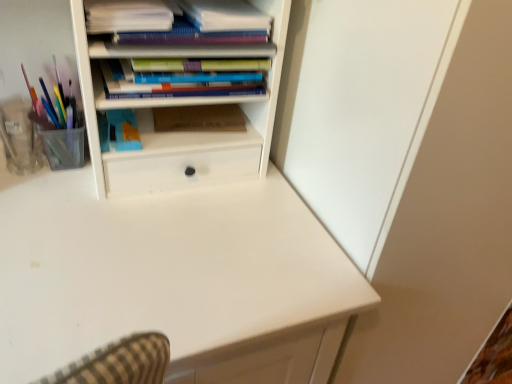
You are a GUI agent. You are given a task and a screenshot of the screen. Output one action in this format:
    pyautogui.click(x=<x>, y=<y>)
    Task: Click on the hardcover books at upper center, the first book positioned from the bottom
    
    Given the screenshot: What is the action you would take?
    pyautogui.click(x=177, y=82)

This screenshot has height=384, width=512. Identify the location of white paper stack at upper left, acting as the first book starting from the top. (127, 16).

Where is `blue matte paperback book at center, placed as the 2th paperback book when sorted from right to left`? blue matte paperback book at center, placed as the 2th paperback book when sorted from right to left is located at coordinates (123, 130).

This screenshot has width=512, height=384. Identify the location of white matte desk at center. (174, 280).

This screenshot has width=512, height=384. What do you see at coordinates (174, 280) in the screenshot? I see `white matte desk at center` at bounding box center [174, 280].

This screenshot has height=384, width=512. I want to click on hardcover books at upper center, the first book positioned from the bottom, so click(177, 82).

In terms of height, does white paper stack at upper left, the third book positioned from the bottom, look taller or shorter compared to blue matte paperback book at center, the 1th paperback book viewed from the left?

white paper stack at upper left, the third book positioned from the bottom, is taller than blue matte paperback book at center, the 1th paperback book viewed from the left.

Based on the photo, is white paper stack at upper left, acting as the first book starting from the top, wider than blue matte paperback book at center, the 1th paperback book viewed from the left?

Correct, the width of white paper stack at upper left, acting as the first book starting from the top, exceeds that of blue matte paperback book at center, the 1th paperback book viewed from the left.

Is white paper stack at upper left, acting as the first book starting from the top, smaller than blue matte paperback book at center, placed as the 2th paperback book when sorted from right to left?

No, white paper stack at upper left, acting as the first book starting from the top, is not smaller than blue matte paperback book at center, placed as the 2th paperback book when sorted from right to left.

Find the location of `paperback book on the left of white paper stack at upper left, the third book positioned from the bottom`. paperback book on the left of white paper stack at upper left, the third book positioned from the bottom is located at coordinates (123, 130).

Is white matte desk at center situated inside hardcover books at upper center, the first book positioned from the bottom, or outside?

white matte desk at center is not enclosed by hardcover books at upper center, the first book positioned from the bottom.

From a real-world perspective, who is located higher, white matte desk at center or hardcover books at upper center, the third book from the top?

From a 3D spatial view, hardcover books at upper center, the third book from the top, is above.

Considering the positions of objects white matte desk at center and hardcover books at upper center, the third book from the top, in the image provided, who is more to the left, white matte desk at center or hardcover books at upper center, the third book from the top,?

white matte desk at center.

Which of these two, white matte desk at center or hardcover books at upper center, the first book positioned from the bottom, stands taller?

white matte desk at center.

Is brown cardboard at center, the 1th paperback book viewed from the right, facing away from hardcover books at upper center, the first book positioned from the bottom?

No.

Is brown cardboard at center, the 1th paperback book viewed from the right, bigger or smaller than hardcover books at upper center, the first book positioned from the bottom?

Considering their sizes, brown cardboard at center, the 1th paperback book viewed from the right, takes up less space than hardcover books at upper center, the first book positioned from the bottom.

Is there a large distance between brown cardboard at center, the 1th paperback book viewed from the right, and hardcover books at upper center, the third book from the top?

No, there isn't a large distance between brown cardboard at center, the 1th paperback book viewed from the right, and hardcover books at upper center, the third book from the top.

Is brown cardboard at center, placed as the 2th paperback book when sorted from left to right, outside of hardcover books at upper center, the first book positioned from the bottom?

Yes, brown cardboard at center, placed as the 2th paperback book when sorted from left to right, is outside of hardcover books at upper center, the first book positioned from the bottom.

Find the location of `computer desk that is under the white paper stack at upper left, the third book positioned from the bottom (from a real-world perspective)`. computer desk that is under the white paper stack at upper left, the third book positioned from the bottom (from a real-world perspective) is located at coordinates (174, 280).

Is white matte desk at center positioned with its back to white paper stack at upper left, the third book positioned from the bottom?

white matte desk at center does not have its back to white paper stack at upper left, the third book positioned from the bottom.

Is white matte desk at center bigger than white paper stack at upper left, acting as the first book starting from the top?

Yes, white matte desk at center is bigger than white paper stack at upper left, acting as the first book starting from the top.

From a real-world perspective, is white matte desk at center physically located above or below white paper stack at upper left, the third book positioned from the bottom?

In terms of real-world spatial position, white matte desk at center is below white paper stack at upper left, the third book positioned from the bottom.

Looking at this image, is white paper stack at upper left, acting as the first book starting from the top, thinner than white matte desk at center?

Indeed, white paper stack at upper left, acting as the first book starting from the top, has a lesser width compared to white matte desk at center.

Considering the sizes of objects white paper stack at upper left, acting as the first book starting from the top, and white matte desk at center in the image provided, who is bigger, white paper stack at upper left, acting as the first book starting from the top, or white matte desk at center?

With larger size is white matte desk at center.

This screenshot has width=512, height=384. I want to click on the 1st book behind the white matte desk at center, starting your count from the anchor, so click(127, 16).

From the image's perspective, would you say brown cardboard at center, the 1th paperback book viewed from the right, is shown under matte purple notebook at upper center, positioned as the 2th book in bottom-to-top order?

Correct, brown cardboard at center, the 1th paperback book viewed from the right, appears lower than matte purple notebook at upper center, positioned as the 2th book in bottom-to-top order, in the image.

Is brown cardboard at center, the 1th paperback book viewed from the right, facing towards matte purple notebook at upper center, positioned as the 2th book in bottom-to-top order?

No, brown cardboard at center, the 1th paperback book viewed from the right, is not oriented towards matte purple notebook at upper center, positioned as the 2th book in bottom-to-top order.

Which object is further away from the camera, brown cardboard at center, placed as the 2th paperback book when sorted from left to right, or matte purple notebook at upper center, the 2th book positioned from the top?

brown cardboard at center, placed as the 2th paperback book when sorted from left to right, is further away from the camera.

Considering the relative sizes of hardcover books at upper center, the first book positioned from the bottom, and white matte desk at center in the image provided, is hardcover books at upper center, the first book positioned from the bottom, shorter than white matte desk at center?

Correct, hardcover books at upper center, the first book positioned from the bottom, is not as tall as white matte desk at center.

Considering the relative sizes of hardcover books at upper center, the first book positioned from the bottom, and white matte desk at center in the image provided, is hardcover books at upper center, the first book positioned from the bottom, wider than white matte desk at center?

No, hardcover books at upper center, the first book positioned from the bottom, is not wider than white matte desk at center.

Does hardcover books at upper center, the third book from the top, appear on the right side of white matte desk at center?

Yes, hardcover books at upper center, the third book from the top, is to the right of white matte desk at center.

Where is `book that is the 3rd one above the blue matte paperback book at center, placed as the 2th paperback book when sorted from right to left (from a real-world perspective)`? The height and width of the screenshot is (384, 512). book that is the 3rd one above the blue matte paperback book at center, placed as the 2th paperback book when sorted from right to left (from a real-world perspective) is located at coordinates (127, 16).

The image size is (512, 384). What are the coordinates of `the 2nd book counting from the right of the white matte desk at center` in the screenshot? It's located at (177, 82).

When comparing their distances from white matte desk at center, does blue matte paperback book at center, the 1th paperback book viewed from the left, or hardcover books at upper center, the first book positioned from the bottom, seem further?

The object further to white matte desk at center is hardcover books at upper center, the first book positioned from the bottom.

From the image, which object appears to be nearer to white paper stack at upper left, the third book positioned from the bottom, white matte desk at center or brown cardboard at center, the 1th paperback book viewed from the right?

brown cardboard at center, the 1th paperback book viewed from the right, lies closer to white paper stack at upper left, the third book positioned from the bottom, than the other object.

Looking at the image, which one is located further to brown cardboard at center, the 1th paperback book viewed from the right, white paper stack at upper left, the third book positioned from the bottom, or hardcover books at upper center, the third book from the top?

Among the two, white paper stack at upper left, the third book positioned from the bottom, is located further to brown cardboard at center, the 1th paperback book viewed from the right.

Looking at the image, which one is located further to hardcover books at upper center, the first book positioned from the bottom, brown cardboard at center, the 1th paperback book viewed from the right, or white matte desk at center?

white matte desk at center lies further to hardcover books at upper center, the first book positioned from the bottom, than the other object.

When comparing their distances from white paper stack at upper left, acting as the first book starting from the top, does white matte desk at center or blue matte paperback book at center, the 1th paperback book viewed from the left, seem closer?

blue matte paperback book at center, the 1th paperback book viewed from the left, lies closer to white paper stack at upper left, acting as the first book starting from the top, than the other object.

Looking at the image, which one is located further to blue matte paperback book at center, the 1th paperback book viewed from the left, hardcover books at upper center, the third book from the top, or brown cardboard at center, the 1th paperback book viewed from the right?

hardcover books at upper center, the third book from the top, is further to blue matte paperback book at center, the 1th paperback book viewed from the left.

Based on their spatial positions, is white paper stack at upper left, the third book positioned from the bottom, or blue matte paperback book at center, placed as the 2th paperback book when sorted from right to left, closer to white matte desk at center?

blue matte paperback book at center, placed as the 2th paperback book when sorted from right to left.

From the image, which object appears to be nearer to hardcover books at upper center, the first book positioned from the bottom, blue matte paperback book at center, placed as the 2th paperback book when sorted from right to left, or matte purple notebook at upper center, the 2th book positioned from the top?

matte purple notebook at upper center, the 2th book positioned from the top, lies closer to hardcover books at upper center, the first book positioned from the bottom, than the other object.

Where is `paperback book between white matte desk at center and brown cardboard at center, placed as the 2th paperback book when sorted from left to right, in the front-back direction`? The height and width of the screenshot is (384, 512). paperback book between white matte desk at center and brown cardboard at center, placed as the 2th paperback book when sorted from left to right, in the front-back direction is located at coordinates (123, 130).

The image size is (512, 384). Find the location of `paperback book located between white paper stack at upper left, acting as the first book starting from the top, and brown cardboard at center, the 1th paperback book viewed from the right, in the depth direction`. paperback book located between white paper stack at upper left, acting as the first book starting from the top, and brown cardboard at center, the 1th paperback book viewed from the right, in the depth direction is located at coordinates (123, 130).

I want to click on book that lies between white paper stack at upper left, the third book positioned from the bottom, and hardcover books at upper center, the third book from the top, from top to bottom, so click(169, 23).

Where is `book between matte purple notebook at upper center, the 2th book positioned from the top, and white matte desk at center from top to bottom`? The height and width of the screenshot is (384, 512). book between matte purple notebook at upper center, the 2th book positioned from the top, and white matte desk at center from top to bottom is located at coordinates (177, 82).